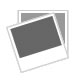
The width and height of the screenshot is (80, 80). In order to click on photo frame in this screenshot , I will do `click(29, 63)`, `click(48, 58)`, `click(61, 54)`, `click(61, 38)`, `click(34, 20)`, `click(13, 44)`.